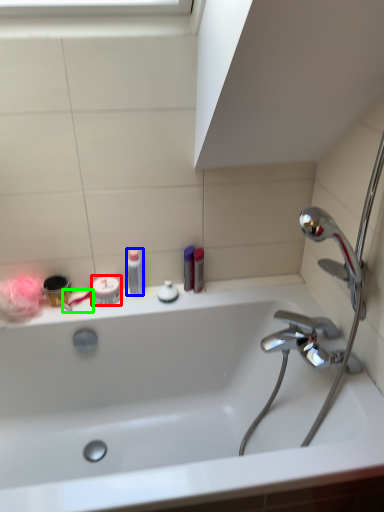
Question: Which object is positioned closest to mouthwash (highlighted by a red box)? Select from toiletry (highlighted by a blue box) and toothbrush (highlighted by a green box).

Choices:
 (A) toiletry
 (B) toothbrush

Answer: (B)